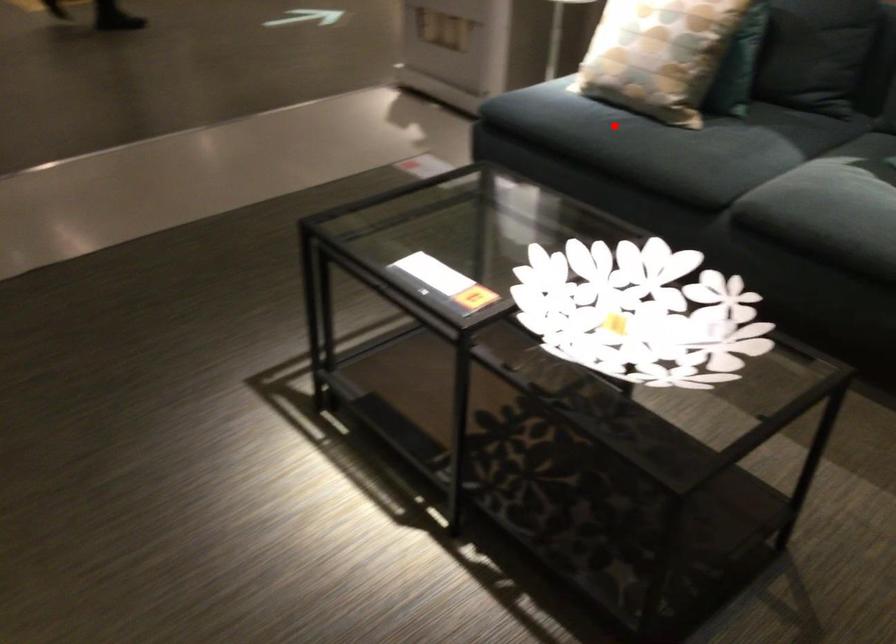
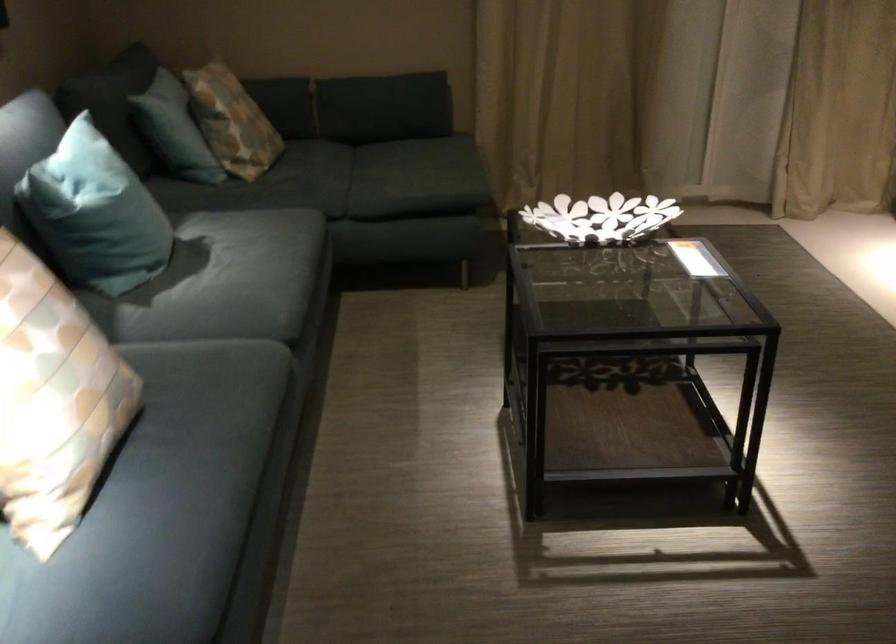
Question: I am providing you with two images of the same scene from different viewpoints. A red point is marked on the first image. Is the red point's position out of view in image 2?

Choices:
 (A) Yes
 (B) No

Answer: (B)